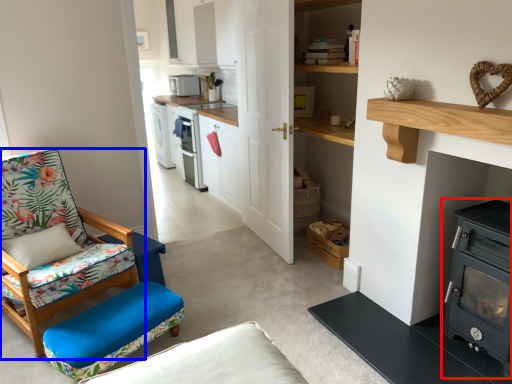
Question: Which object is closer to the camera taking this photo, wood burning stove (highlighted by a red box) or chair (highlighted by a blue box)?

Choices:
 (A) wood burning stove
 (B) chair

Answer: (A)